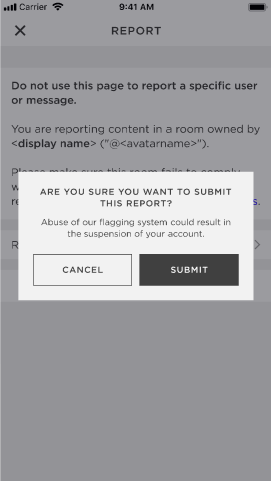
This screenshot has height=481, width=271. Find the location of `exit button`. exit button is located at coordinates (19, 30).